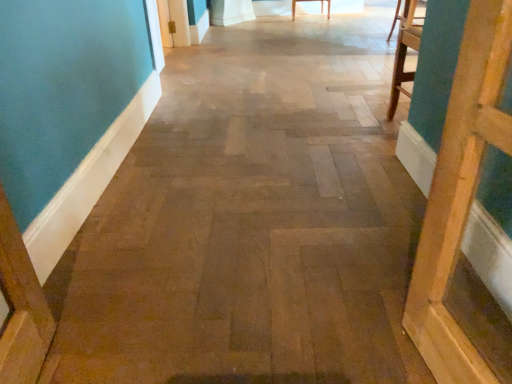
Question: Should I look upward or downward to see wooden floor at center?

Choices:
 (A) up
 (B) down

Answer: (A)